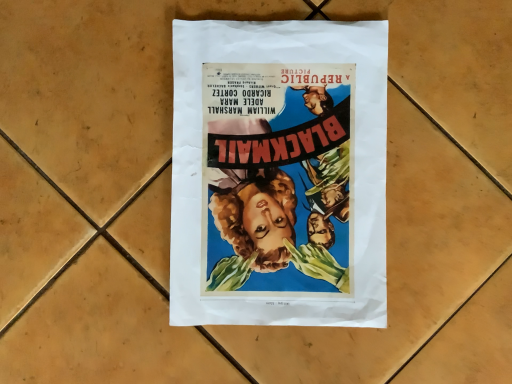
This screenshot has height=384, width=512. In order to click on matte paper poster at center in this screenshot , I will do `click(279, 173)`.

Describe the element at coordinates (279, 173) in the screenshot. I see `matte paper poster at center` at that location.

The height and width of the screenshot is (384, 512). Find the location of `matte paper poster at center`. matte paper poster at center is located at coordinates (279, 173).